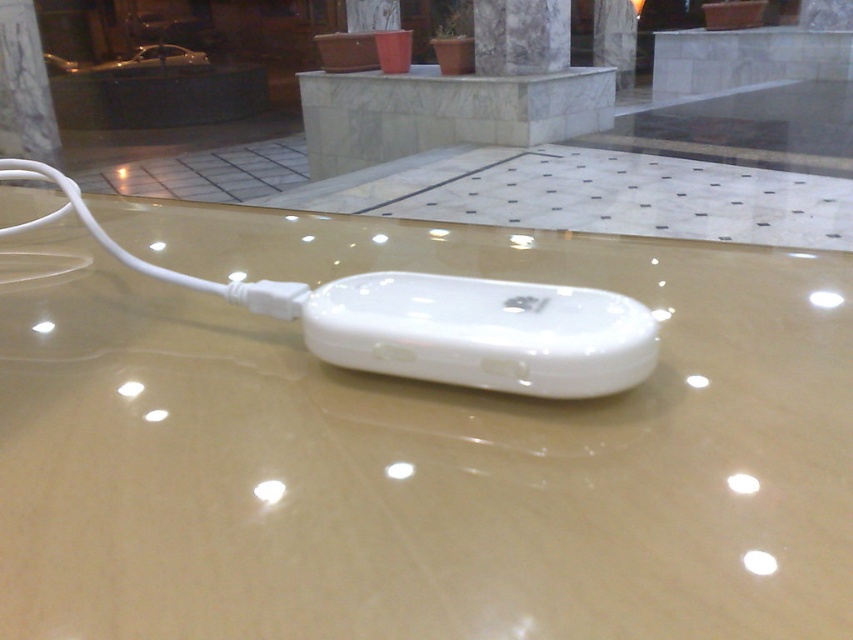
Question: Which of the following is the closest to the observer?

Choices:
 (A) pos(483,285)
 (B) pos(653,568)
 (C) pos(479,49)

Answer: (B)

Question: Which point is closer to the camera?

Choices:
 (A) white glossy ipod at center
 (B) white marble pillar at upper center

Answer: (A)

Question: Considering the relative positions of transparent glossy glass table at center and white marble pillar at upper center in the image provided, where is transparent glossy glass table at center located with respect to white marble pillar at upper center?

Choices:
 (A) below
 (B) above

Answer: (A)

Question: Is white glossy ipod at center wider than white marble pillar at upper center?

Choices:
 (A) yes
 (B) no

Answer: (B)

Question: From the image, what is the correct spatial relationship of white glossy ipod at center in relation to white marble pillar at upper center?

Choices:
 (A) above
 (B) below

Answer: (B)

Question: Which of the following is the closest to the observer?

Choices:
 (A) transparent glossy glass table at center
 (B) white marble pillar at upper center

Answer: (A)